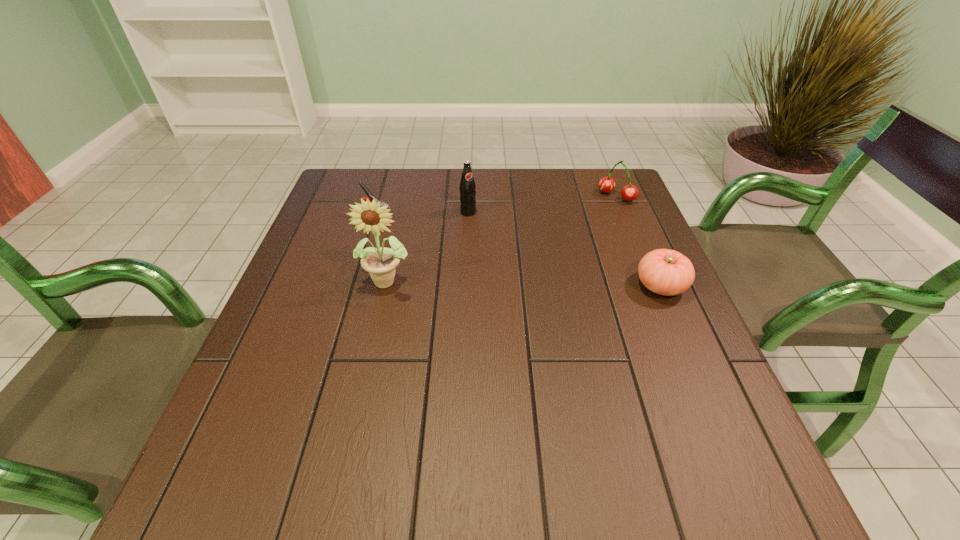
Choose which object is the nearest neighbor to the fourth shortest object. Please provide its 2D coordinates. Your answer should be formatted as a tuple, i.e. [(x, y)], where the tuple contains the x and y coordinates of a point satisfying the conditions above.

[(370, 197)]

Point out which object is positioned as the second nearest to the tomato. Please provide its 2D coordinates. Your answer should be formatted as a tuple, i.e. [(x, y)], where the tuple contains the x and y coordinates of a point satisfying the conditions above.

[(467, 188)]

Locate an element on the screen. vacant space that satisfies the following two spatial constraints: 1. on the back side of the pop; 2. on the right side of the farthest object is located at coordinates (468, 197).